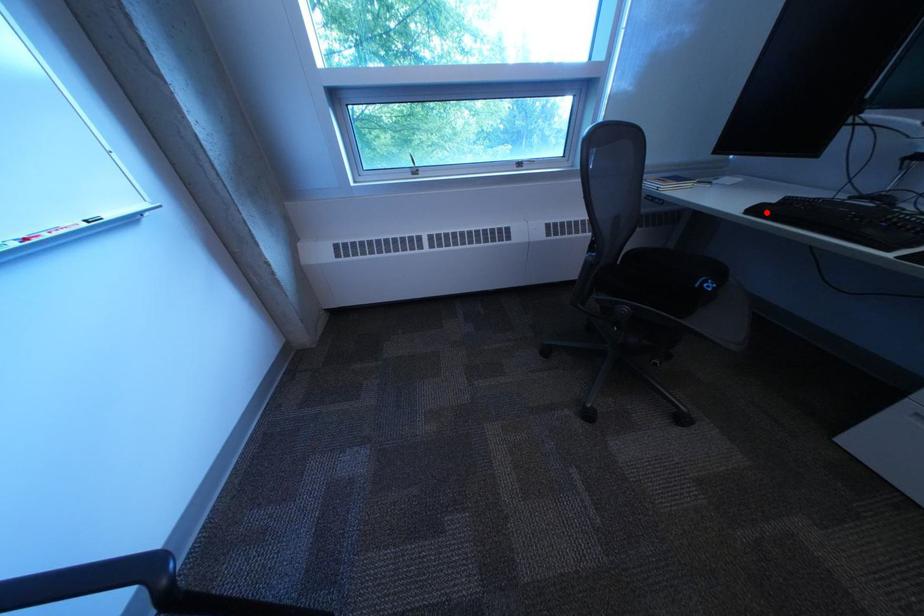
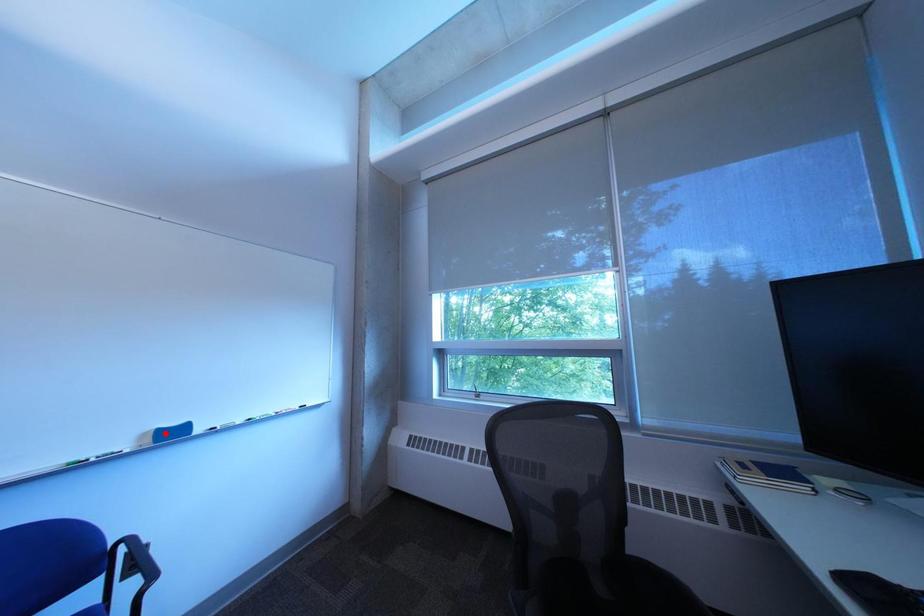
I am providing you with two images of the same scene from different viewpoints. A red point is marked on the first image and another point is marked on the second image. Is the marked point in image1 the same physical position as the marked point in image2?

No